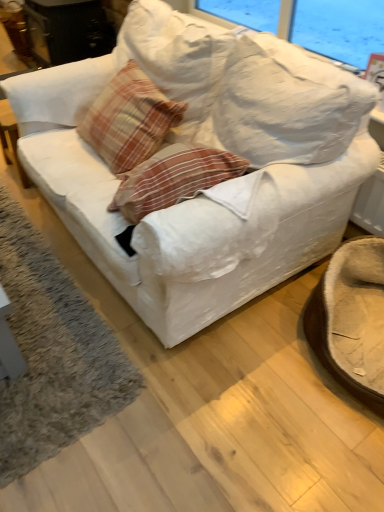
Describe the element at coordinates (218, 185) in the screenshot. I see `white fabric couch at center` at that location.

Measure the distance between soft gray carpet at lower left and camera.

soft gray carpet at lower left and camera are 4.13 feet apart.

In order to click on brown fuzzy swivel chair at lower right in this screenshot , I will do `click(351, 319)`.

Are plaid fabric pillow at center and brown fuzzy swivel chair at lower right located far from each other?

Yes, plaid fabric pillow at center is far from brown fuzzy swivel chair at lower right.

Based on the photo, considering the relative positions of plaid fabric pillow at center and brown fuzzy swivel chair at lower right in the image provided, is plaid fabric pillow at center to the left of brown fuzzy swivel chair at lower right from the viewer's perspective?

Yes, plaid fabric pillow at center is to the left of brown fuzzy swivel chair at lower right.

Is plaid fabric pillow at center in front of or behind brown fuzzy swivel chair at lower right in the image?

plaid fabric pillow at center is behind brown fuzzy swivel chair at lower right.

Is plaid fabric pillow at center completely or partially outside of brown fuzzy swivel chair at lower right?

That's correct, plaid fabric pillow at center is outside of brown fuzzy swivel chair at lower right.

Does soft gray carpet at lower left appear on the left side of white fabric couch at center?

Correct, you'll find soft gray carpet at lower left to the left of white fabric couch at center.

Is soft gray carpet at lower left positioned with its back to white fabric couch at center?

soft gray carpet at lower left is not turned away from white fabric couch at center.

Is point (95, 349) farther from camera compared to point (121, 257)?

Yes, it is.

Considering the relative positions of brown fuzzy swivel chair at lower right and plaid fabric pillow at center in the image provided, is brown fuzzy swivel chair at lower right in front of plaid fabric pillow at center?

Yes, it is in front of plaid fabric pillow at center.

Consider the image. From a real-world perspective, is brown fuzzy swivel chair at lower right physically above plaid fabric pillow at center?

Actually, brown fuzzy swivel chair at lower right is physically below plaid fabric pillow at center in the real world.

Does brown fuzzy swivel chair at lower right have a greater width compared to plaid fabric pillow at center?

Yes.

Consider the image. Which point is more distant from viewer, (360, 278) or (178, 120)?

The point (178, 120) is behind.

From the image's perspective, which is below, white fabric couch at center or brown fuzzy swivel chair at lower right?

brown fuzzy swivel chair at lower right, from the image's perspective.

Which object is closer to the camera taking this photo, white fabric couch at center or brown fuzzy swivel chair at lower right?

white fabric couch at center.

Consider the image. Does white fabric couch at center turn towards brown fuzzy swivel chair at lower right?

No, white fabric couch at center is not facing towards brown fuzzy swivel chair at lower right.

Is white fabric couch at center not near brown fuzzy swivel chair at lower right?

white fabric couch at center is actually quite close to brown fuzzy swivel chair at lower right.

Would you consider brown fuzzy swivel chair at lower right to be distant from white fabric couch at center?

No, brown fuzzy swivel chair at lower right is not far away from white fabric couch at center.

From a real-world perspective, which object stands above the other?

white fabric couch at center is physically above.

Which object is thinner, brown fuzzy swivel chair at lower right or white fabric couch at center?

brown fuzzy swivel chair at lower right.

Is brown fuzzy swivel chair at lower right turned away from white fabric couch at center?

That's not correct — brown fuzzy swivel chair at lower right is not looking away from white fabric couch at center.

Considering the sizes of plaid fabric pillow at center and white fabric couch at center in the image, is plaid fabric pillow at center wider or thinner than white fabric couch at center?

In the image, plaid fabric pillow at center appears to be more narrow than white fabric couch at center.

Does point (87, 137) lie in front of point (284, 166)?

No, (87, 137) is further to viewer.

How different are the orientations of plaid fabric pillow at center and white fabric couch at center in degrees?

The angular difference between plaid fabric pillow at center and white fabric couch at center is 1.71 degrees.

Are soft gray carpet at lower left and plaid fabric pillow at center making contact?

No, soft gray carpet at lower left is not beside plaid fabric pillow at center.

Which is more to the right, soft gray carpet at lower left or plaid fabric pillow at center?

plaid fabric pillow at center.

From a real-world perspective, which object stands above the other?

plaid fabric pillow at center, from a real-world perspective.

Image resolution: width=384 pixels, height=512 pixels. Find the location of `throw pillow above the brown fuzzy swivel chair at lower right (from the image's perspective)`. throw pillow above the brown fuzzy swivel chair at lower right (from the image's perspective) is located at coordinates (129, 119).

Identify the location of studio couch lying in front of the soft gray carpet at lower left. The image size is (384, 512). (218, 185).

Based on their spatial positions, is white fabric couch at center or soft gray carpet at lower left closer to brown fuzzy swivel chair at lower right?

The object closer to brown fuzzy swivel chair at lower right is white fabric couch at center.

Which object lies nearer to the anchor point soft gray carpet at lower left, brown fuzzy swivel chair at lower right or plaid fabric pillow at center?

plaid fabric pillow at center is closer to soft gray carpet at lower left.

Estimate the real-world distances between objects in this image. Which object is closer to white fabric couch at center, brown fuzzy swivel chair at lower right or soft gray carpet at lower left?

Based on the image, brown fuzzy swivel chair at lower right appears to be nearer to white fabric couch at center.

From the image, which object appears to be nearer to white fabric couch at center, brown fuzzy swivel chair at lower right or plaid fabric pillow at center?

Among the two, plaid fabric pillow at center is located nearer to white fabric couch at center.

From the image, which object appears to be nearer to plaid fabric pillow at center, brown fuzzy swivel chair at lower right or soft gray carpet at lower left?

soft gray carpet at lower left is closer to plaid fabric pillow at center.

Looking at the image, which one is located closer to plaid fabric pillow at center, white fabric couch at center or soft gray carpet at lower left?

white fabric couch at center is positioned closer to the anchor plaid fabric pillow at center.

When comparing their distances from plaid fabric pillow at center, does soft gray carpet at lower left or white fabric couch at center seem further?

soft gray carpet at lower left.

Which object lies nearer to the anchor point brown fuzzy swivel chair at lower right, soft gray carpet at lower left or plaid fabric pillow at center?

soft gray carpet at lower left.

Locate an element on the screen. The width and height of the screenshot is (384, 512). studio couch located between plaid fabric pillow at center and brown fuzzy swivel chair at lower right in the left-right direction is located at coordinates (218, 185).

Find the location of a particular element. The width and height of the screenshot is (384, 512). throw pillow between soft gray carpet at lower left and brown fuzzy swivel chair at lower right from left to right is located at coordinates (129, 119).

You are a GUI agent. You are given a task and a screenshot of the screen. Output one action in this format:
    pyautogui.click(x=<x>, y=<y>)
    Task: Click on the studio couch between plaid fabric pillow at center and soft gray carpet at lower left vertically
    The height and width of the screenshot is (512, 384).
    Given the screenshot: What is the action you would take?
    pyautogui.click(x=218, y=185)

Find the location of a particular element. This screenshot has width=384, height=512. studio couch between soft gray carpet at lower left and brown fuzzy swivel chair at lower right is located at coordinates (218, 185).